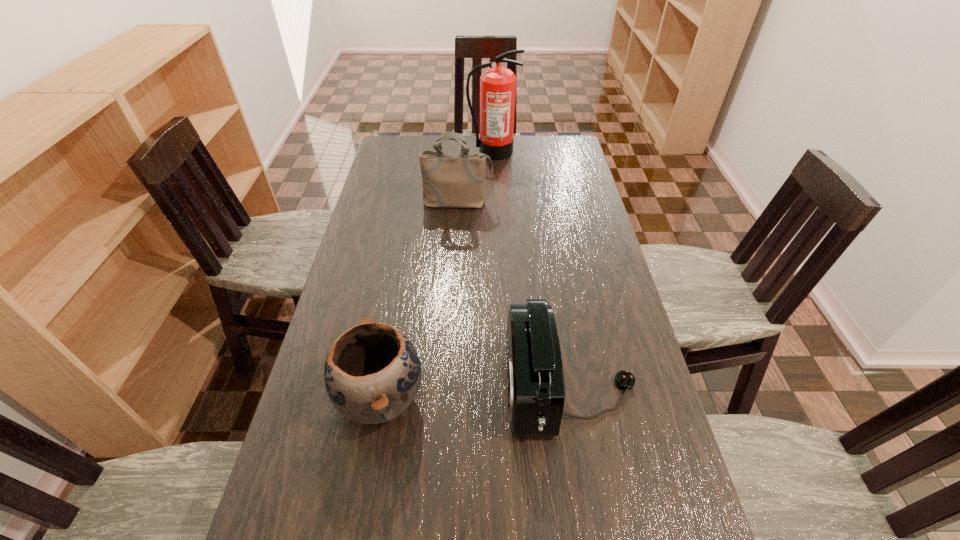
You are a GUI agent. You are given a task and a screenshot of the screen. Output one action in this format:
    pyautogui.click(x=<x>, y=<y>)
    Task: Click on the free space between the radio receiver and the pottery
    The image size is (960, 540).
    Given the screenshot: What is the action you would take?
    pyautogui.click(x=475, y=391)

The width and height of the screenshot is (960, 540). What are the coordinates of `vacant point located between the pottery and the shoulder bag` in the screenshot? It's located at (420, 300).

The width and height of the screenshot is (960, 540). Identify the location of vacant space in between the radio receiver and the fire extinguisher. [x=531, y=268].

Locate an element on the screen. The image size is (960, 540). vacant space that is in between the radio receiver and the shoulder bag is located at coordinates (514, 294).

This screenshot has height=540, width=960. In order to click on free space between the radio receiver and the second farthest object in this screenshot , I will do `click(514, 294)`.

I want to click on object that is the third closest to the radio receiver, so click(497, 85).

The width and height of the screenshot is (960, 540). In order to click on object that ranks as the second closest to the radio receiver in this screenshot , I will do `click(449, 180)`.